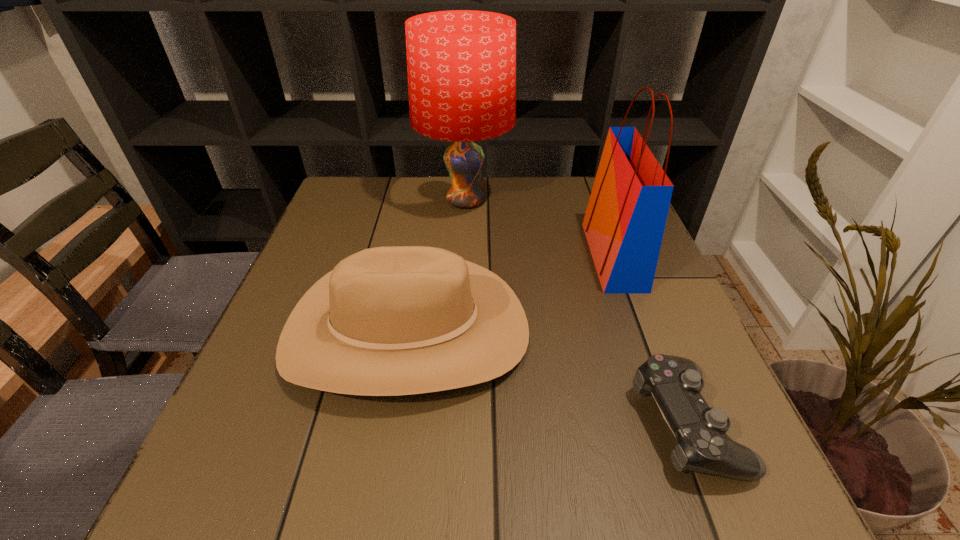
You are a GUI agent. You are given a task and a screenshot of the screen. Output one action in this format:
    pyautogui.click(x=<x>, y=<y>)
    Task: Click on the object positioned at the far edge
    The image size is (960, 540).
    Given the screenshot: What is the action you would take?
    pyautogui.click(x=461, y=64)

Find the location of a particular element. The width and height of the screenshot is (960, 540). object positioned at the near edge is located at coordinates (702, 445).

Locate an element on the screen. The height and width of the screenshot is (540, 960). object present at the left edge is located at coordinates (398, 320).

You are a GUI agent. You are given a task and a screenshot of the screen. Output one action in this format:
    pyautogui.click(x=<x>, y=<y>)
    Task: Click on the shopping bag at the right edge
    
    Given the screenshot: What is the action you would take?
    pyautogui.click(x=624, y=223)

This screenshot has height=540, width=960. Find the location of `control at the right edge`. control at the right edge is located at coordinates (702, 445).

Locate an element on the screen. The height and width of the screenshot is (540, 960). object at the near right corner is located at coordinates (702, 445).

In the image, there is a desktop. Where is `vacant space at the far edge`? The width and height of the screenshot is (960, 540). vacant space at the far edge is located at coordinates (508, 188).

Image resolution: width=960 pixels, height=540 pixels. In the image, there is a desktop. In order to click on vacant space at the near edge in this screenshot , I will do `click(395, 472)`.

Where is `vacant space at the left edge of the desktop`? This screenshot has height=540, width=960. vacant space at the left edge of the desktop is located at coordinates (341, 240).

This screenshot has height=540, width=960. I want to click on vacant region at the right edge of the desktop, so click(x=688, y=315).